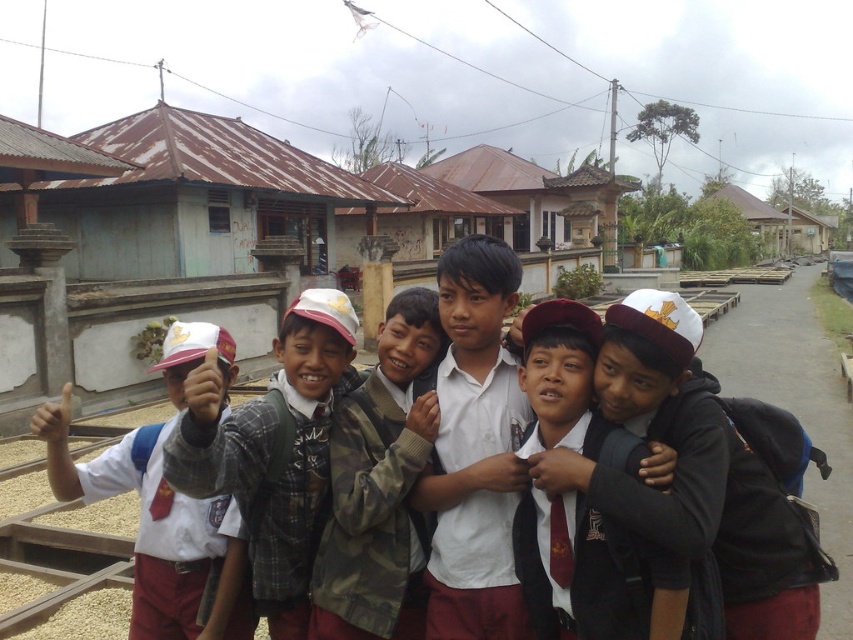
Question: Which point is farther to the camera?

Choices:
 (A) (558, 305)
 (B) (363, 593)

Answer: (B)

Question: Which point is closer to the camera taking this photo?

Choices:
 (A) (521, 561)
 (B) (669, 525)

Answer: (B)

Question: Which object is closer to the camera taking this photo?

Choices:
 (A) plaid shirt at center
 (B) maroon uniform at center
 (C) matte white cap at left
 (D) camouflage jacket at center

Answer: (A)

Question: Is camouflage jacket at center wider than matte white cap at left?

Choices:
 (A) yes
 (B) no

Answer: (B)

Question: Can you confirm if white matte uniform at center is positioned to the right of maroon uniform at center?

Choices:
 (A) no
 (B) yes

Answer: (A)

Question: Does white matte uniform at center come behind camouflage jacket at center?

Choices:
 (A) yes
 (B) no

Answer: (B)